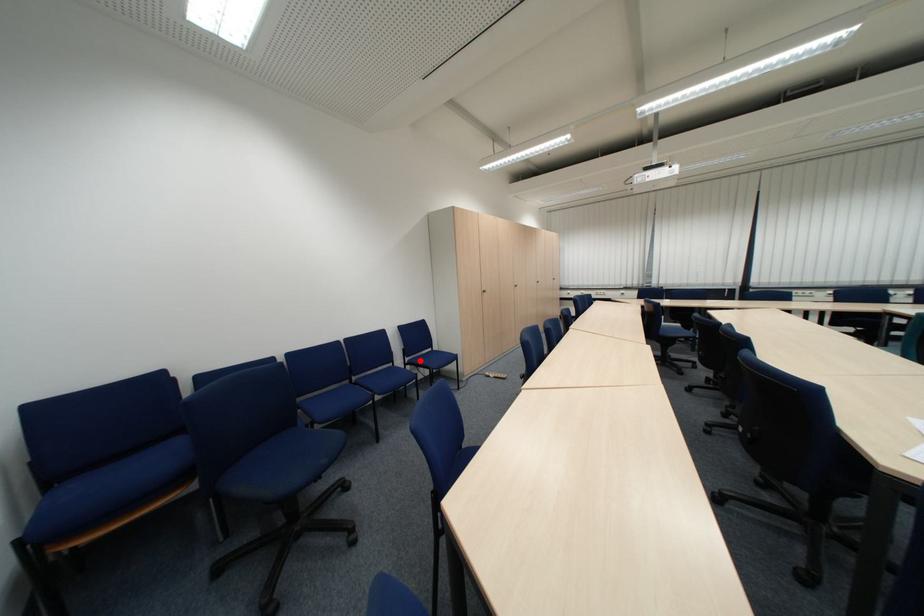
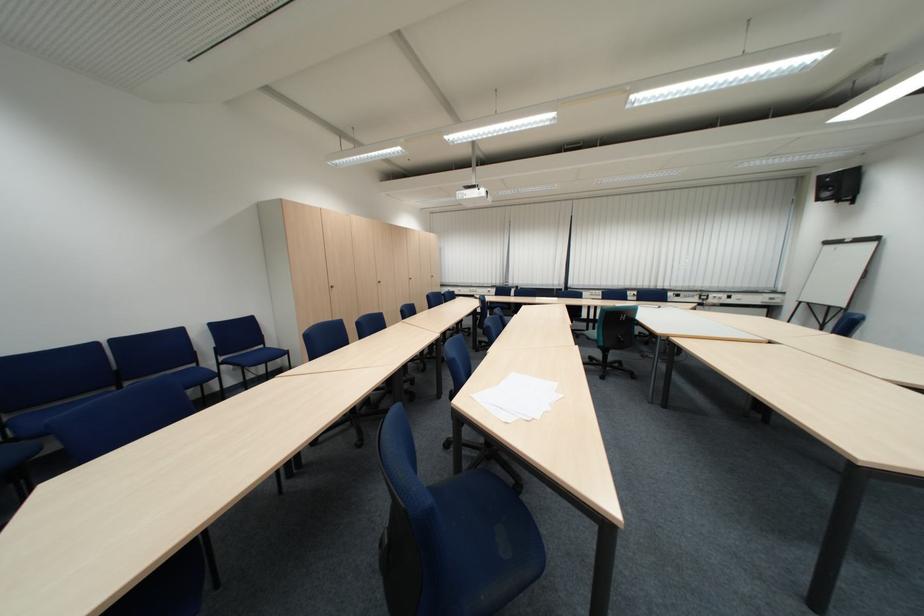
Find the pixel in the second image that matches the highlighted location in the first image.

(235, 360)